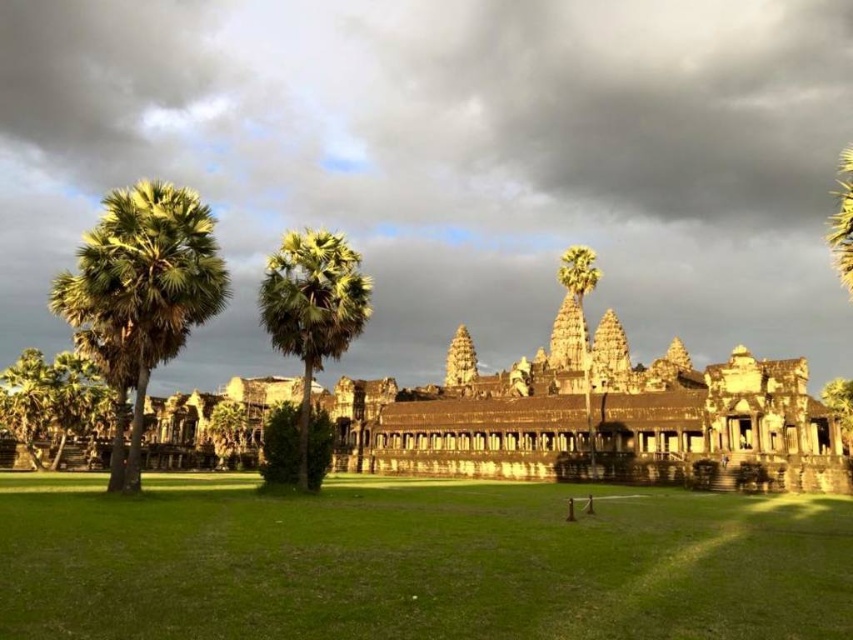
Question: Which of the following is the closest to the observer?

Choices:
 (A) (77, 342)
 (B) (308, 314)
 (C) (296, 456)

Answer: (B)

Question: Which point is farther to the camera?

Choices:
 (A) (335, 310)
 (B) (276, 417)
 (C) (91, 568)

Answer: (B)

Question: Is the position of green leafy palm tree at center more distant than that of green leafy bush at center?

Choices:
 (A) yes
 (B) no

Answer: (B)

Question: Which point appears closest to the camera in this image?

Choices:
 (A) (271, 278)
 (B) (16, 493)

Answer: (B)

Question: Can you confirm if green grass at center is positioned below green leafy bush at center?

Choices:
 (A) no
 (B) yes

Answer: (B)

Question: Where is green grass at center located in relation to green leafy palm tree at left in the image?

Choices:
 (A) right
 (B) left

Answer: (A)